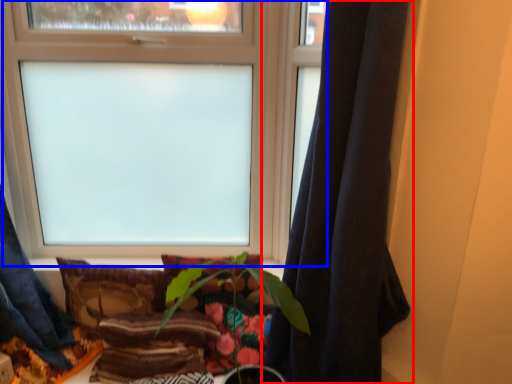
Question: Among these objects, which one is farthest to the camera, curtain (highlighted by a red box) or window (highlighted by a blue box)?

Choices:
 (A) curtain
 (B) window

Answer: (B)